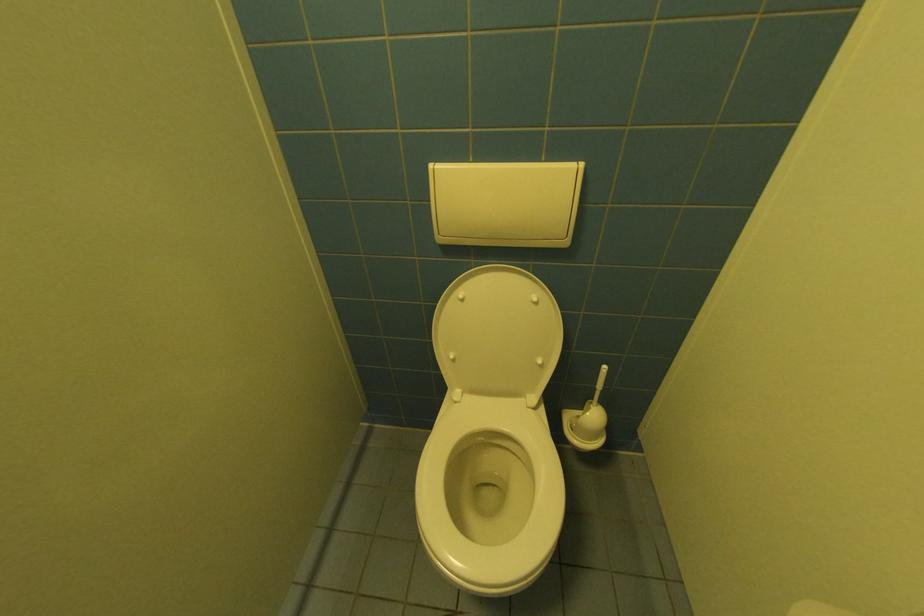
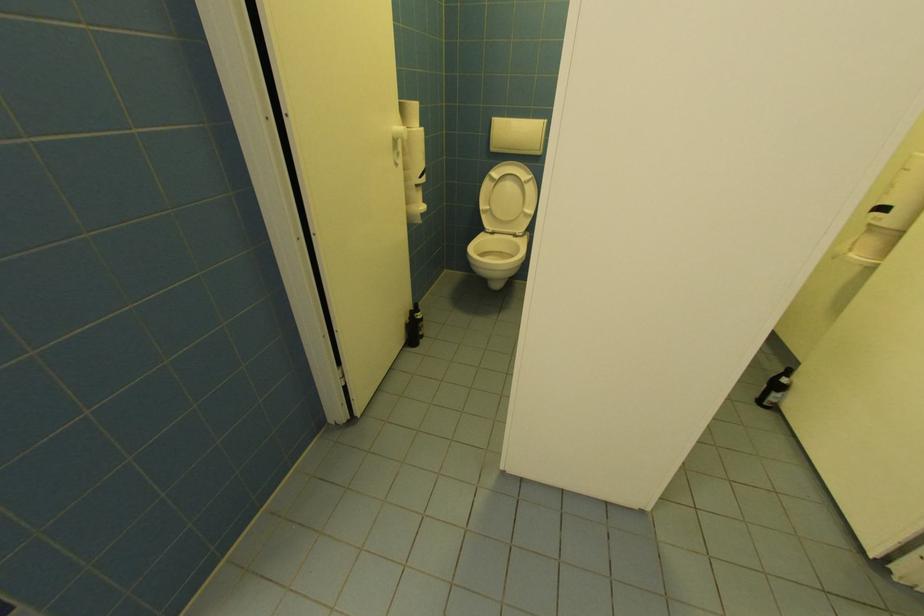
What movement of the cameraman would produce the second image?

The movement direction of the cameraman is left, backward.